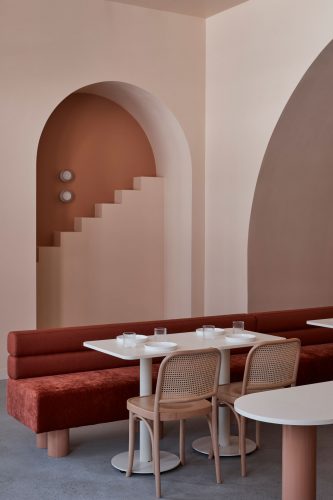
This screenshot has height=500, width=333. In order to click on chair in this screenshot , I will do `click(188, 386)`.